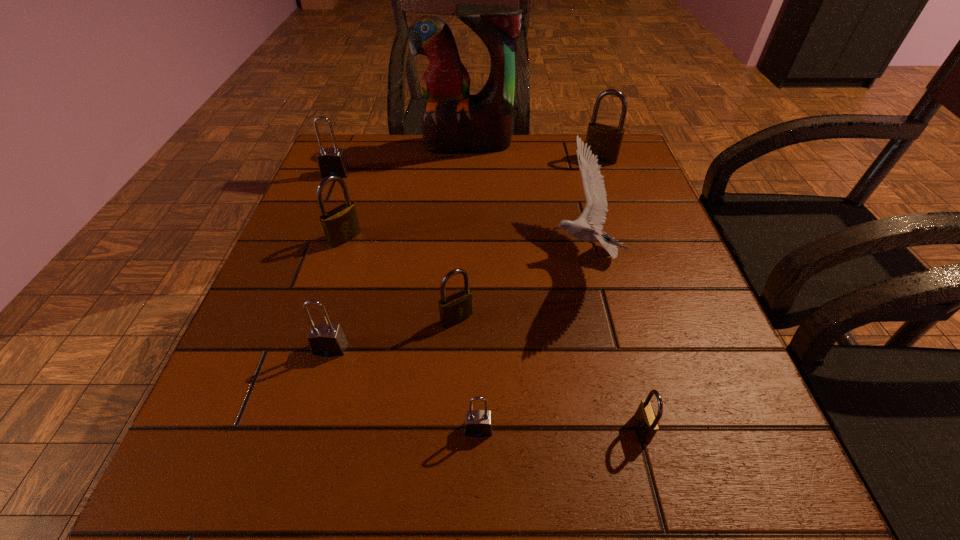
Where is `unoccupied position between the nearest gray padlock and the second brass padlock from left to right`? The height and width of the screenshot is (540, 960). unoccupied position between the nearest gray padlock and the second brass padlock from left to right is located at coordinates (468, 374).

At what (x,y) coordinates should I click in order to perform the action: click on free area in between the second nearest brass padlock and the second smallest gray padlock. Please return your answer as a coordinate pair (x, y). The image size is (960, 540). Looking at the image, I should click on (394, 334).

The height and width of the screenshot is (540, 960). Find the location of `empty space between the rightmost gray padlock and the biggest gray padlock`. empty space between the rightmost gray padlock and the biggest gray padlock is located at coordinates (x=407, y=301).

Identify the location of free space between the seventh farthest object and the rightmost brass padlock. This screenshot has height=540, width=960. (465, 253).

What are the coordinates of `vacant point located between the fifth farthest padlock and the farthest brass padlock` in the screenshot? It's located at (465, 253).

I want to click on unoccupied position between the tallest object and the third biggest brass padlock, so click(462, 232).

Find the location of `empty space between the nearest gray padlock and the leftmost gray padlock`. empty space between the nearest gray padlock and the leftmost gray padlock is located at coordinates (407, 301).

Where is `the fourth closest object to the gull`? The image size is (960, 540). the fourth closest object to the gull is located at coordinates (453, 121).

This screenshot has height=540, width=960. In order to click on object that can be found as the third closest to the parrot in this screenshot , I will do `click(594, 214)`.

Choose which padlock is the fourth nearest neighbor to the nearest gray padlock. Please provide its 2D coordinates. Your answer should be formatted as a tuple, i.e. [(x, y)], where the tuple contains the x and y coordinates of a point satisfying the conditions above.

[(340, 225)]